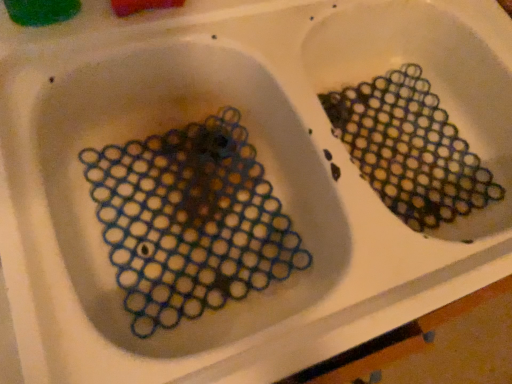
Question: Is translucent plastic mesh at upper right, the second debris in the left-to-right sequence, positioned in front of translucent plastic mesh at left, marked as the 1th debris in a left-to-right arrangement?

Choices:
 (A) no
 (B) yes

Answer: (A)

Question: Does translucent plastic mesh at upper right, the first debris in the right-to-left sequence, have a greater height compared to translucent plastic mesh at left, marked as the 1th debris in a left-to-right arrangement?

Choices:
 (A) no
 (B) yes

Answer: (A)

Question: Can you confirm if translucent plastic mesh at upper right, the first debris in the right-to-left sequence, is bigger than translucent plastic mesh at left, the second debris when ordered from right to left?

Choices:
 (A) no
 (B) yes

Answer: (A)

Question: Is translucent plastic mesh at upper right, the first debris in the right-to-left sequence, not near translucent plastic mesh at left, the second debris when ordered from right to left?

Choices:
 (A) yes
 (B) no

Answer: (B)

Question: Is translucent plastic mesh at left, the second debris when ordered from right to left, completely or partially inside translucent plastic mesh at upper right, the second debris in the left-to-right sequence?

Choices:
 (A) yes
 (B) no

Answer: (B)

Question: Is translucent plastic mesh at upper right, the first debris in the right-to-left sequence, behind translucent plastic mesh at left, the second debris when ordered from right to left?

Choices:
 (A) yes
 (B) no

Answer: (A)

Question: Considering the relative sizes of translucent plastic mesh at left, the second debris when ordered from right to left, and translucent plastic mesh at upper right, the second debris in the left-to-right sequence, in the image provided, is translucent plastic mesh at left, the second debris when ordered from right to left, wider than translucent plastic mesh at upper right, the second debris in the left-to-right sequence,?

Choices:
 (A) yes
 (B) no

Answer: (A)

Question: Is translucent plastic mesh at left, marked as the 1th debris in a left-to-right arrangement, thinner than translucent plastic mesh at upper right, the first debris in the right-to-left sequence?

Choices:
 (A) no
 (B) yes

Answer: (A)

Question: Is translucent plastic mesh at left, marked as the 1th debris in a left-to-right arrangement, at the right side of translucent plastic mesh at upper right, the first debris in the right-to-left sequence?

Choices:
 (A) yes
 (B) no

Answer: (B)

Question: From the image's perspective, is translucent plastic mesh at left, the second debris when ordered from right to left, beneath translucent plastic mesh at upper right, the second debris in the left-to-right sequence?

Choices:
 (A) no
 (B) yes

Answer: (B)

Question: Is translucent plastic mesh at left, marked as the 1th debris in a left-to-right arrangement, shorter than translucent plastic mesh at upper right, the second debris in the left-to-right sequence?

Choices:
 (A) yes
 (B) no

Answer: (B)

Question: Considering the relative sizes of translucent plastic mesh at left, marked as the 1th debris in a left-to-right arrangement, and translucent plastic mesh at upper right, the second debris in the left-to-right sequence, in the image provided, is translucent plastic mesh at left, marked as the 1th debris in a left-to-right arrangement, smaller than translucent plastic mesh at upper right, the second debris in the left-to-right sequence,?

Choices:
 (A) yes
 (B) no

Answer: (B)

Question: Relative to translucent plastic mesh at left, the second debris when ordered from right to left, is translucent plastic mesh at upper right, the first debris in the right-to-left sequence, in front or behind?

Choices:
 (A) behind
 (B) front

Answer: (A)